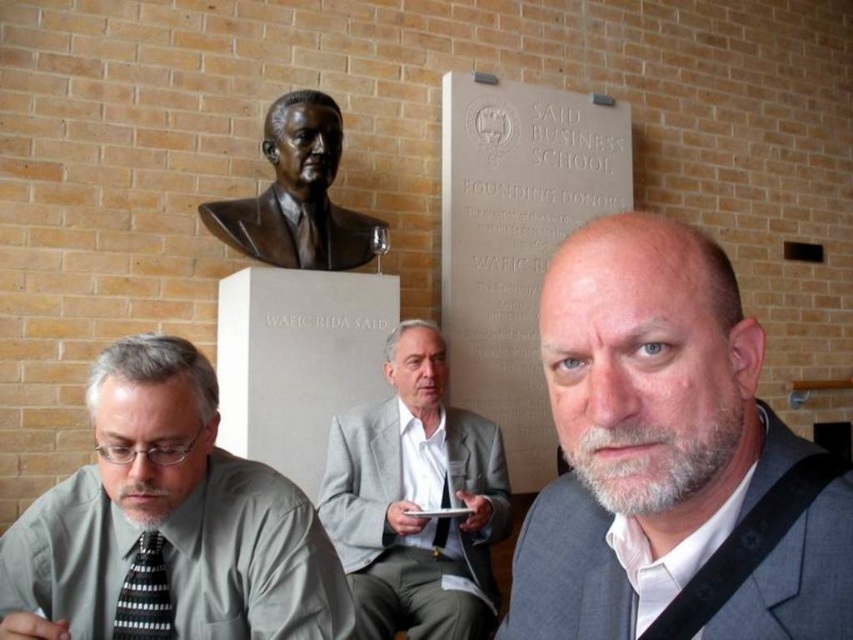
Question: Observing the image, what is the correct spatial positioning of gray wool suit at center in reference to black woven tie at center?

Choices:
 (A) below
 (B) above

Answer: (B)

Question: Is bronze bust at upper center positioned at the back of black woven tie at center?

Choices:
 (A) no
 (B) yes

Answer: (B)

Question: Estimate the real-world distances between objects in this image. Which object is closer to the black woven tie at center?

Choices:
 (A) gray matte shirt at lower left
 (B) black striped tie at lower left
 (C) bronze bust at upper center

Answer: (C)

Question: Which of the following is the farthest from the observer?

Choices:
 (A) (352, 586)
 (B) (764, 540)
 (C) (132, 570)
 (D) (329, 145)

Answer: (D)

Question: In this image, where is gray matte shirt at lower left located relative to black striped tie at lower left?

Choices:
 (A) below
 (B) above

Answer: (B)

Question: Among these objects, which one is farthest from the camera?

Choices:
 (A) gray wool suit at center
 (B) bronze bust at upper center

Answer: (B)